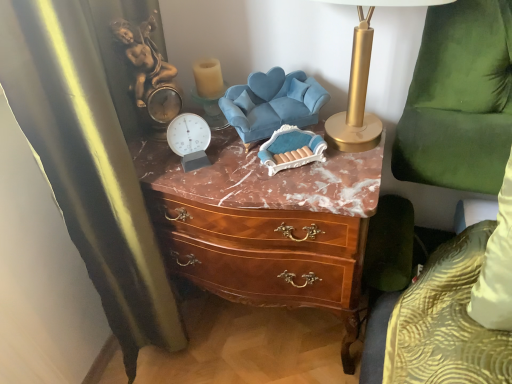
Locate an element on the screen. This screenshot has width=512, height=384. free space above brown wood chest of drawers at center (from a real-world perspective) is located at coordinates (267, 168).